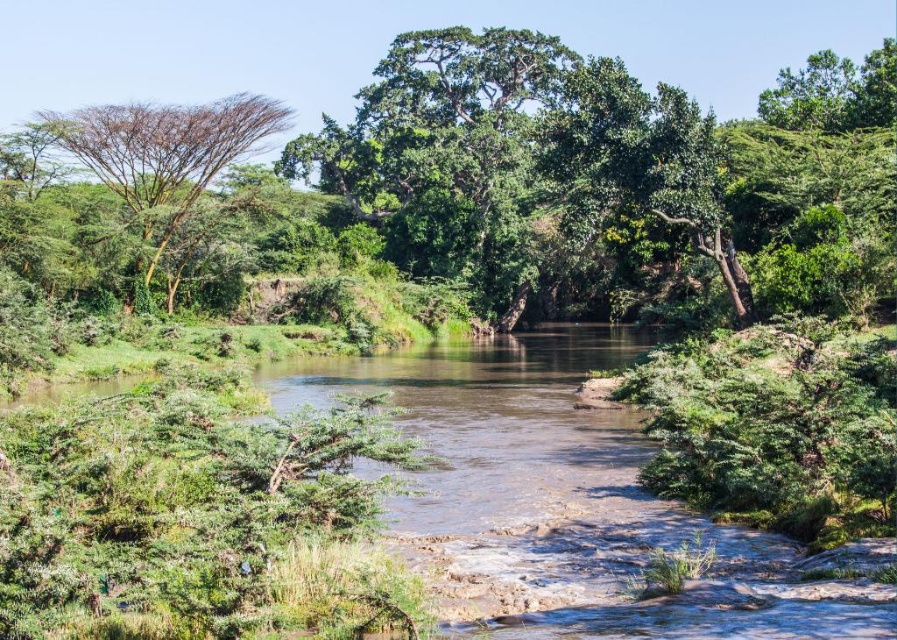
You are a bird seeking a nesting spot. You see the green leafy tree at center and the green leafy tree at left. Which tree has a wider canopy for nesting?

The green leafy tree at center might be wider than the green leafy tree at left, so it could provide a wider canopy for nesting.

You are standing at the riverbank and see the green leafy tree at center and the green leafy tree at left. Which tree would cast a longer shadow on the ground during midday?

The green leafy tree at center is taller than the green leafy tree at left, so it would cast a longer shadow on the ground during midday.